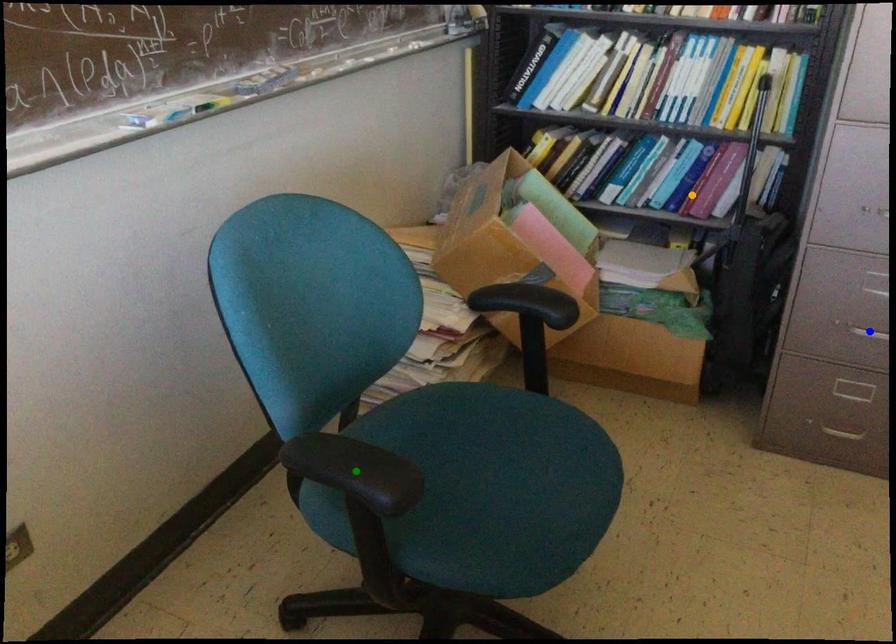
Order these from nearest to farthest:
orange point
green point
blue point

green point → blue point → orange point